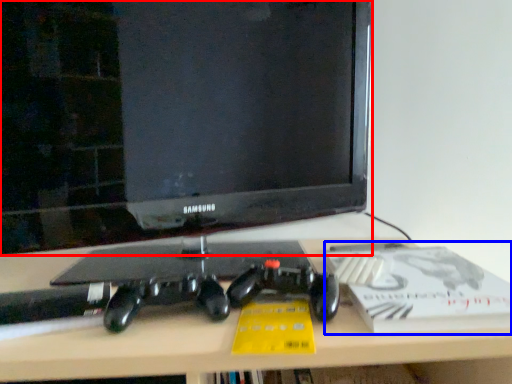
Question: Which of the following is the farthest to the observer, television (highlighted by a red box) or paperback book (highlighted by a blue box)?

Choices:
 (A) television
 (B) paperback book

Answer: (A)